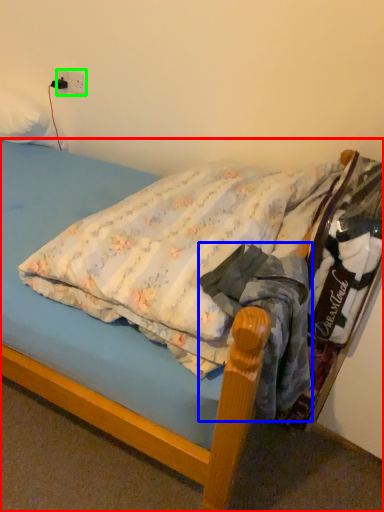
Question: Which object is the closest to the bed (highlighted by a red box)? Choose among these: clothing (highlighted by a blue box) or electric outlet (highlighted by a green box).

Choices:
 (A) clothing
 (B) electric outlet

Answer: (A)